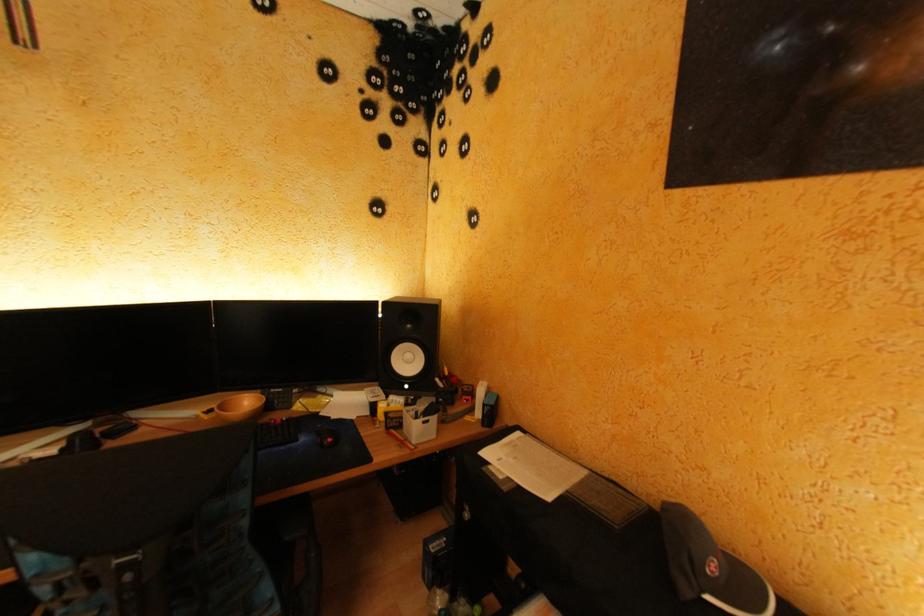
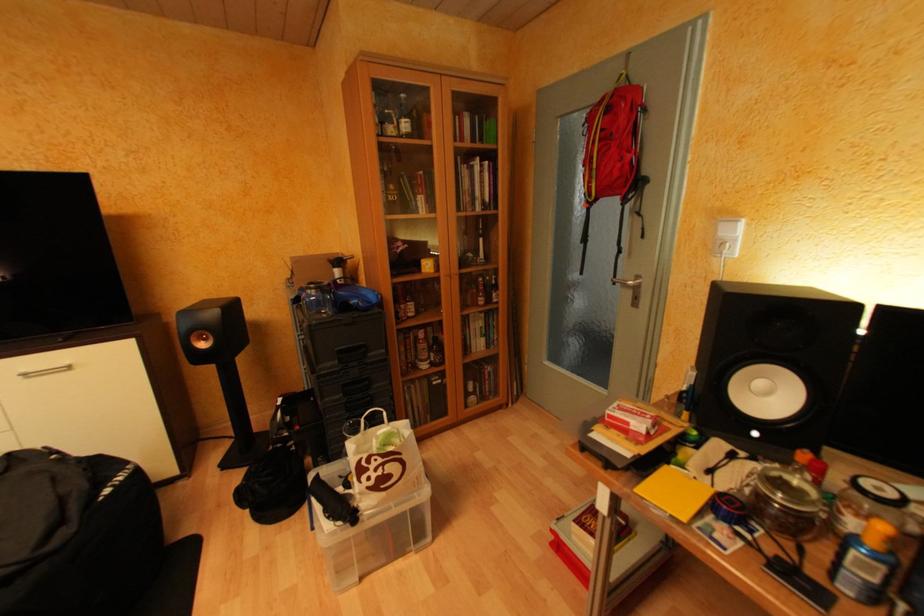
Question: The camera is either moving clockwise (left) or counter-clockwise (right) around the object. The first image is from the beginning of the video and the second image is from the end. Is the camera moving left or right when shooting the video?

Choices:
 (A) Left
 (B) Right

Answer: (B)